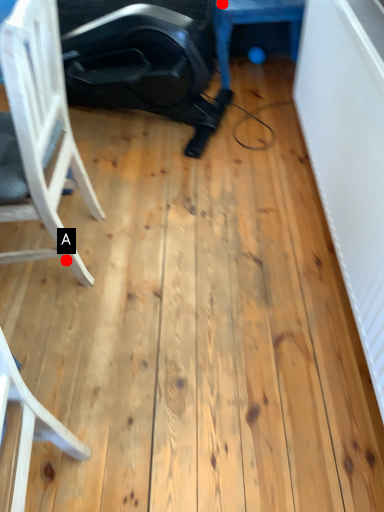
Question: Two points are circled on the image, labeled by A and B beside each circle. Among these points, which one is farthest from the camera?

Choices:
 (A) A is further
 (B) B is further

Answer: (B)